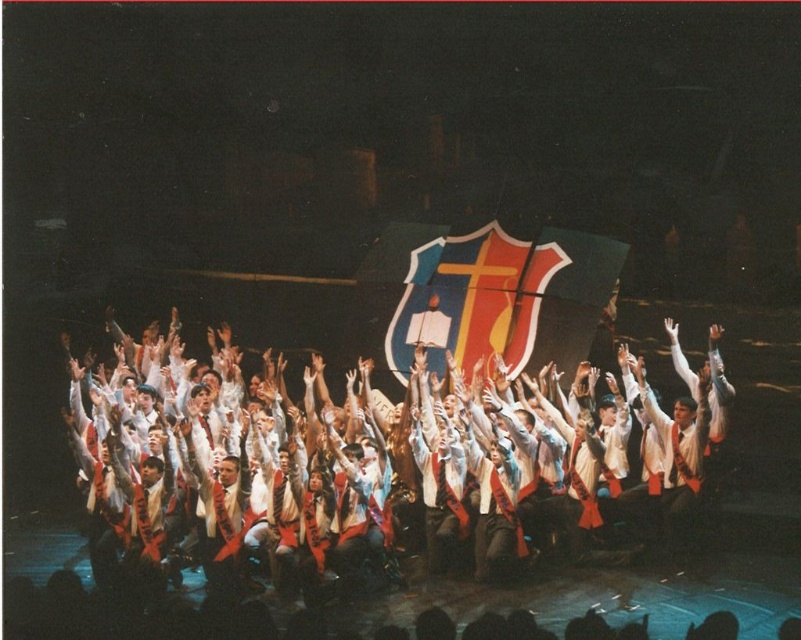
Question: Can you confirm if white fabric shirt at center is positioned below shiny plastic flag at center?

Choices:
 (A) no
 (B) yes

Answer: (B)

Question: Is white fabric shirt at center above shiny plastic flag at center?

Choices:
 (A) no
 (B) yes

Answer: (A)

Question: Does white fabric shirt at center appear under shiny plastic flag at center?

Choices:
 (A) yes
 (B) no

Answer: (A)

Question: Which of the following is the farthest from the observer?

Choices:
 (A) click(x=159, y=545)
 (B) click(x=574, y=234)

Answer: (B)

Question: Which point appears farthest from the camera in this image?

Choices:
 (A) (590, 512)
 (B) (592, 308)

Answer: (B)